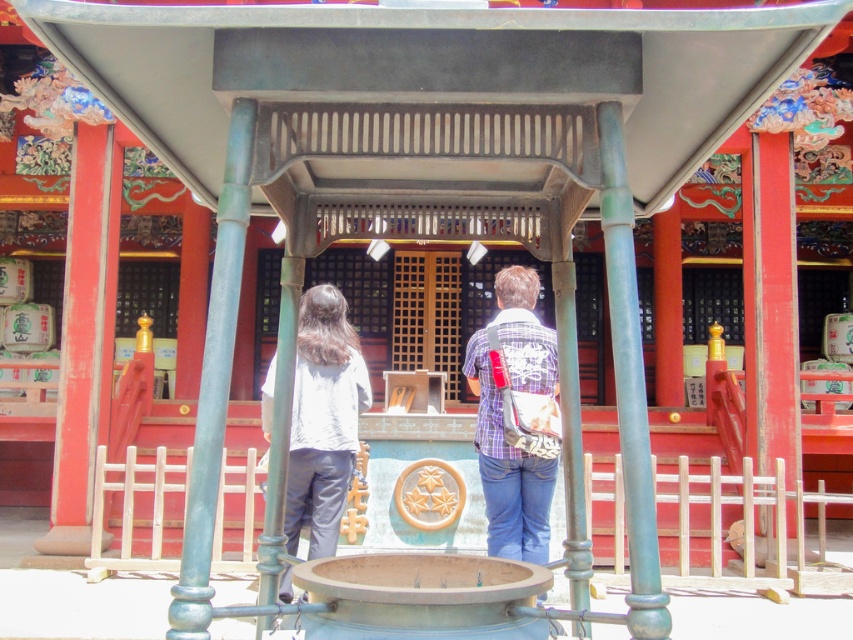
From the picture: Is plaid fabric shirt at center to the right of matte white shirt at center from the viewer's perspective?

Yes, plaid fabric shirt at center is to the right of matte white shirt at center.

Is plaid fabric shirt at center smaller than matte white shirt at center?

Actually, plaid fabric shirt at center might be larger than matte white shirt at center.

You are a GUI agent. You are given a task and a screenshot of the screen. Output one action in this format:
    pyautogui.click(x=<x>, y=<y>)
    Task: Click on the plaid fabric shirt at center
    This screenshot has height=640, width=853.
    Given the screenshot: What is the action you would take?
    pyautogui.click(x=502, y=420)

Who is shorter, light gray fabric shirt at center or plaid fabric shirt at center?

plaid fabric shirt at center is shorter.

Does light gray fabric shirt at center have a smaller size compared to plaid fabric shirt at center?

No.

Is point (297, 532) closer to camera compared to point (526, 378)?

That is False.

At what (x,y) coordinates should I click in order to perform the action: click on light gray fabric shirt at center. Please return your answer as a coordinate pair (x, y). The width and height of the screenshot is (853, 640). Looking at the image, I should click on (323, 419).

Is light gray fabric shirt at center positioned behind matte white shirt at center?

No.

At what (x,y) coordinates should I click in order to perform the action: click on light gray fabric shirt at center. Please return your answer as a coordinate pair (x, y). The width and height of the screenshot is (853, 640). Looking at the image, I should click on (323, 419).